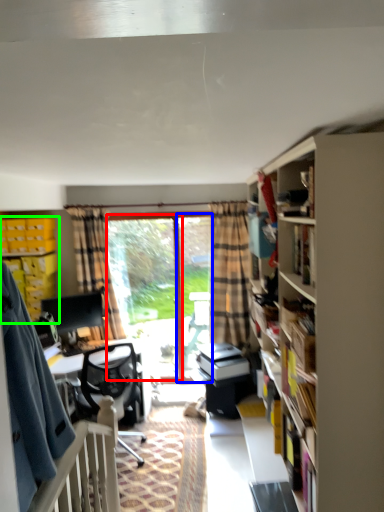
Question: Considering the real-world distances, which object is farthest from window screen (highlighted by a red box)? screen door (highlighted by a blue box) or cabinet (highlighted by a green box)?

Choices:
 (A) screen door
 (B) cabinet

Answer: (B)